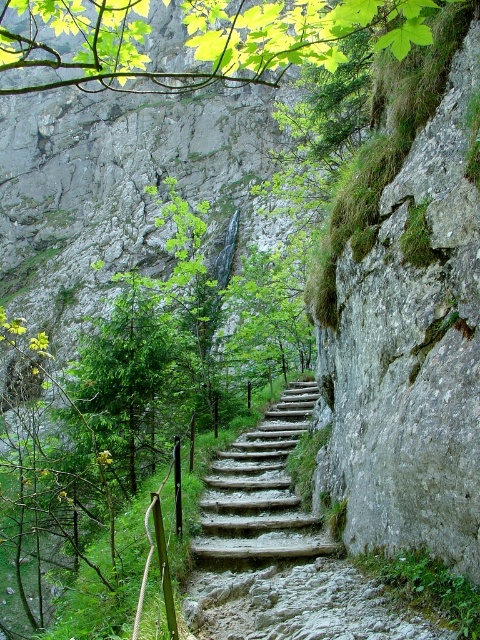
Does point (405, 26) come behind point (289, 388)?

No.

Is point (134, 28) positioned before point (299, 422)?

Yes, it is in front of point (299, 422).

What do you see at coordinates (202, 38) in the screenshot? Image resolution: width=480 pixels, height=640 pixels. I see `green leafy branch at upper center` at bounding box center [202, 38].

At what (x,y) coordinates should I click in order to perform the action: click on green leafy branch at upper center. Please return your answer as a coordinate pair (x, y). The height and width of the screenshot is (640, 480). Looking at the image, I should click on (202, 38).

Which of these two, rustic wooden stairs at center or wooden stairs at center, stands shorter?

wooden stairs at center is shorter.

Is rustic wooden stairs at center shorter than wooden stairs at center?

Incorrect, rustic wooden stairs at center's height does not fall short of wooden stairs at center's.

Is point (252, 525) in front of point (264, 468)?

Yes, it is.

At what (x,y) coordinates should I click in order to perform the action: click on rustic wooden stairs at center. Please return your answer as a coordinate pair (x, y). This screenshot has height=640, width=480. Looking at the image, I should click on (279, 550).

Looking at this image, between rustic wooden stairs at center and green leafy branch at upper center, which one is positioned lower?

Positioned lower is rustic wooden stairs at center.

Is rustic wooden stairs at center below green leafy branch at upper center?

Yes.

Who is more forward, (x=280, y=634) or (x=49, y=65)?

Point (x=280, y=634) is in front.

This screenshot has height=640, width=480. In order to click on rustic wooden stairs at center in this screenshot , I will do `click(279, 550)`.